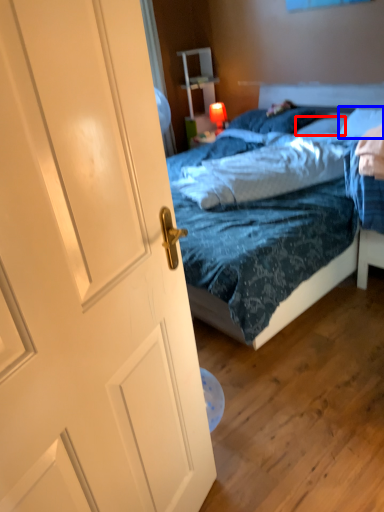
Question: Among these objects, which one is farthest to the camera, pillow (highlighted by a red box) or pillow (highlighted by a blue box)?

Choices:
 (A) pillow
 (B) pillow

Answer: (A)